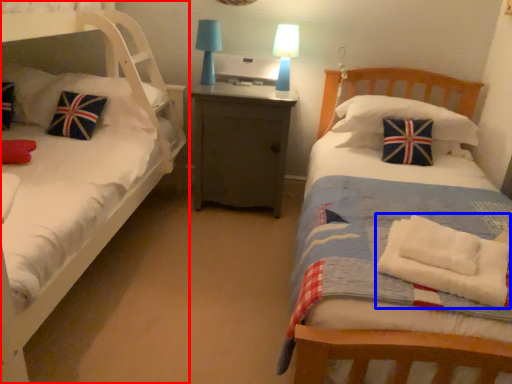
Question: Among these objects, which one is nearest to the camera, bed (highlighted by a red box) or material (highlighted by a blue box)?

Choices:
 (A) bed
 (B) material

Answer: (A)